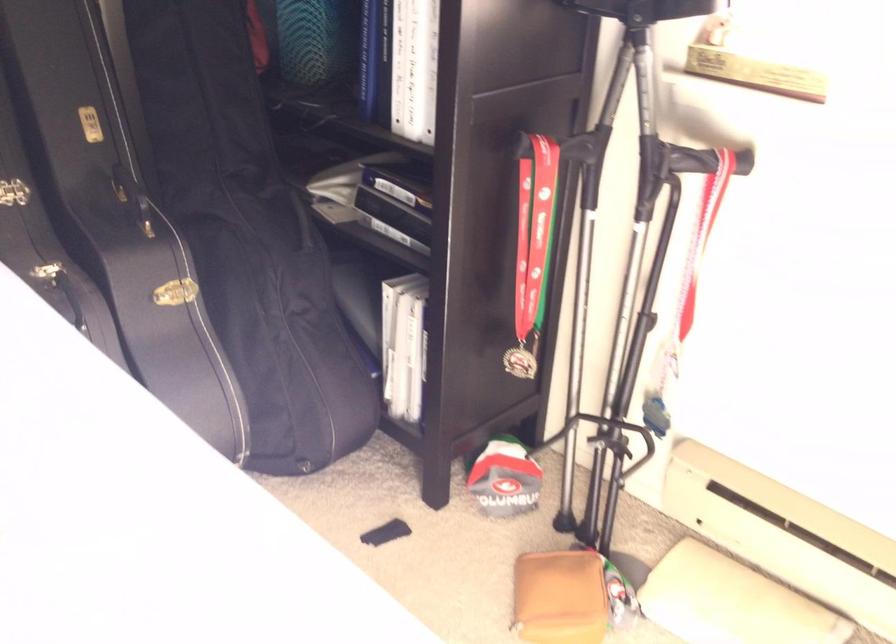
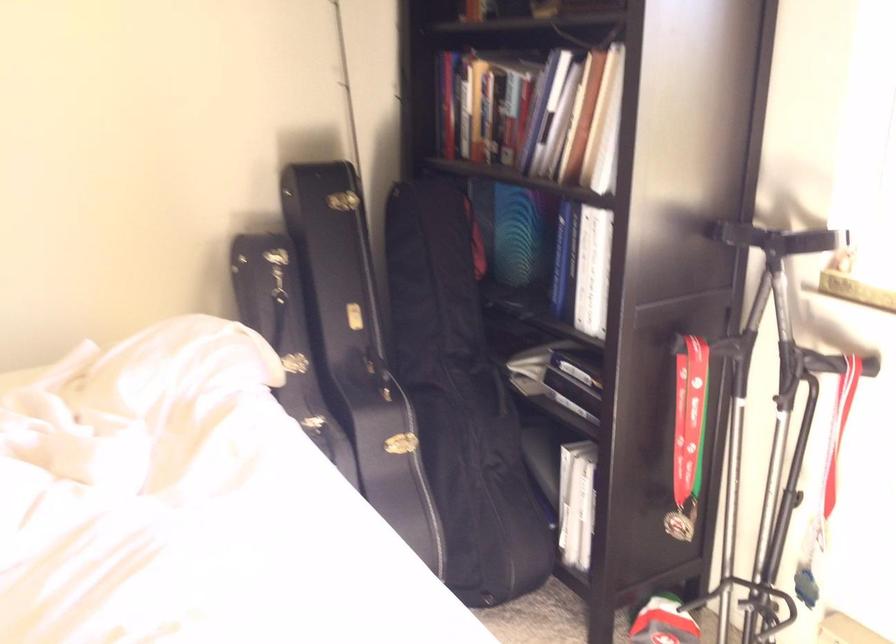
Locate, in the second image, the point that corresponds to (x=252, y=231) in the first image.

(460, 399)